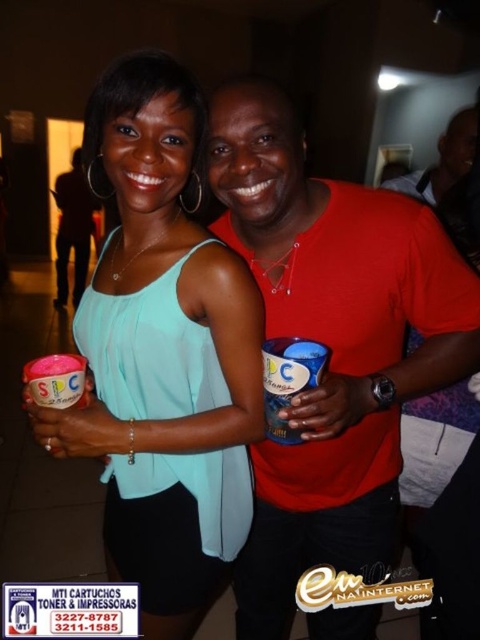
Question: Does matte red shirt at center have a smaller size compared to matte teal blouse at center?

Choices:
 (A) yes
 (B) no

Answer: (B)

Question: Estimate the real-world distances between objects in this image. Which object is farther from the matte red shirt at center?

Choices:
 (A) pink matte cup at center
 (B) blue plastic cup at center

Answer: (A)

Question: Is matte red shirt at center bigger than matte black shirt at center?

Choices:
 (A) yes
 (B) no

Answer: (B)

Question: Which of these objects is positioned closest to the matte teal blouse at center?

Choices:
 (A) matte red shirt at upper right
 (B) matte black shirt at center
 (C) blue plastic cup at center
 (D) pink matte cup at center

Answer: (C)

Question: Is matte teal blouse at center above matte red shirt at upper right?

Choices:
 (A) no
 (B) yes

Answer: (A)

Question: Based on their relative distances, which object is nearer to the matte red shirt at center?

Choices:
 (A) pink matte cup at center
 (B) blue plastic cup at center

Answer: (B)